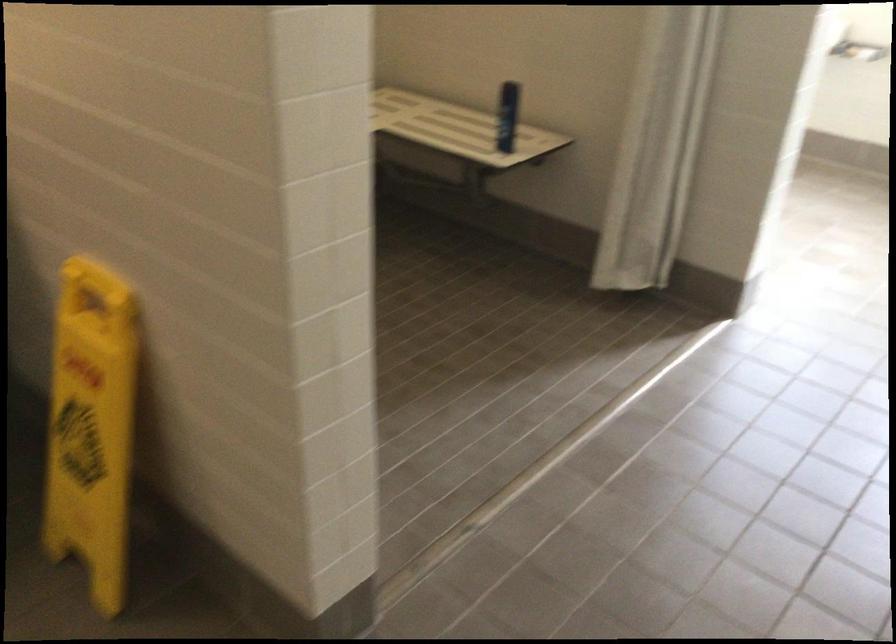
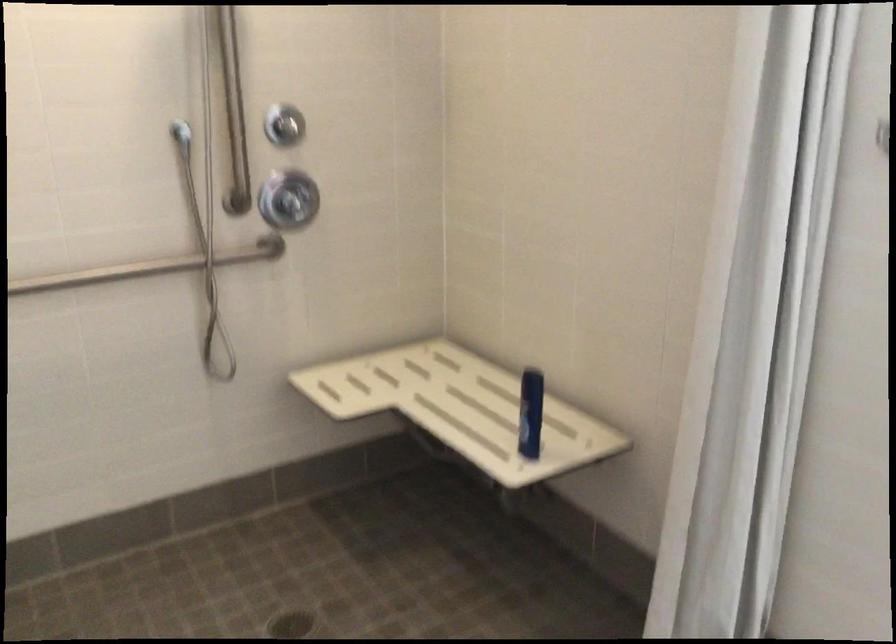
Question: The camera is either moving clockwise (left) or counter-clockwise (right) around the object. The first image is from the beginning of the video and the second image is from the end. Is the camera moving left or right when shooting the video?

Choices:
 (A) Left
 (B) Right

Answer: (B)